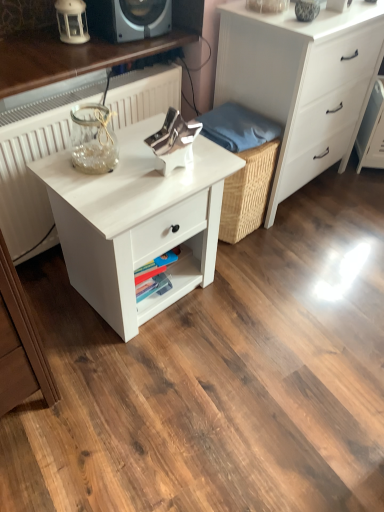
Locate an element on the screen. Image resolution: width=384 pixels, height=512 pixels. free space above white matte nightstand at center (from a real-world perspective) is located at coordinates (139, 165).